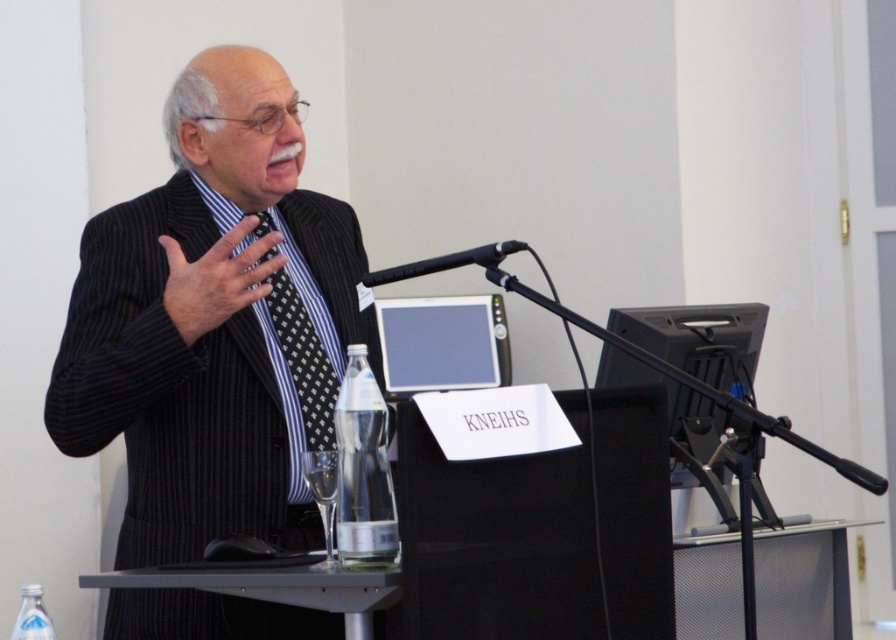
Based on the scene description, which object is taller between the black pinstripe suit at center and the black dotted tie at center?

The black pinstripe suit at center is much taller than the black dotted tie at center.

You are organizing a small event and need to place a name tag on the podium. The name tag is 5 cm wide. You see the clear glass bottle at center and the black dotted tie at center. Which object can the name tag fit under if placed horizontally?

The name tag can fit under the clear glass bottle at center because it has a smaller size compared to the black dotted tie at center.

You are a tailor measuring a mannequin wearing the black pinstripe suit at center and the black dotted tie at center. The mannequin requires a new suit and tie. If the current distance between the suit and tie is 5.73 inches, what is the minimum length of fabric needed to ensure both the suit and tie fit without overlapping?

The minimum length of fabric needed is 5.73 inches to ensure the black pinstripe suit at center and the black dotted tie at center do not overlap, as this distance already accommodates their placement.